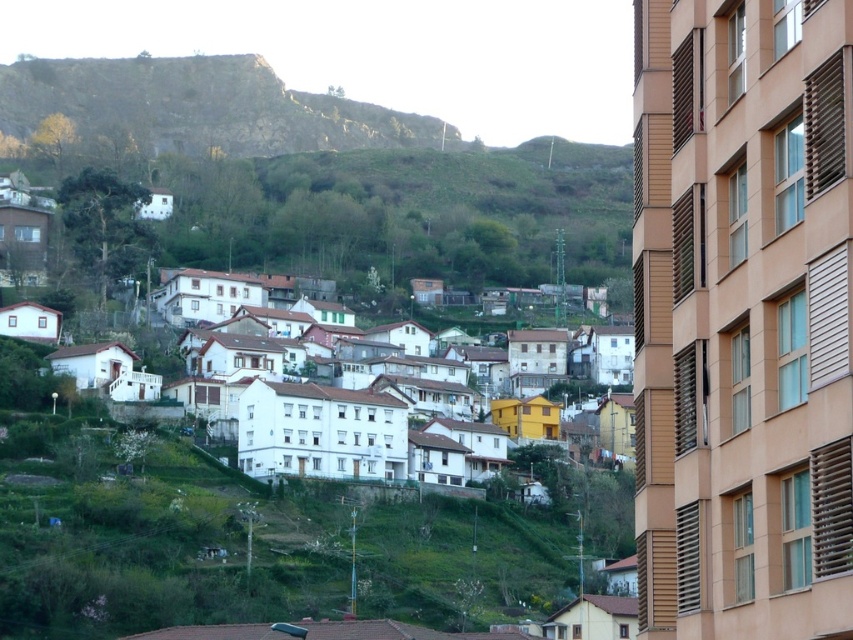
Question: Among these objects, which one is farthest from the camera?

Choices:
 (A) rustic stone hillside at upper left
 (B) white matte houses at center

Answer: (A)

Question: Considering the relative positions of rustic stone hillside at upper left and white matte houses at center in the image provided, where is rustic stone hillside at upper left located with respect to white matte houses at center?

Choices:
 (A) below
 (B) above

Answer: (B)

Question: Is rustic stone hillside at upper left closer to camera compared to white matte houses at center?

Choices:
 (A) yes
 (B) no

Answer: (B)

Question: Among these objects, which one is nearest to the camera?

Choices:
 (A) white matte houses at center
 (B) rustic stone hillside at upper left

Answer: (A)

Question: Can you confirm if rustic stone hillside at upper left is positioned to the right of white matte houses at center?

Choices:
 (A) yes
 (B) no

Answer: (B)